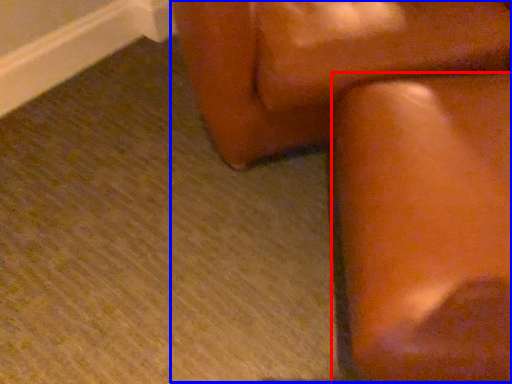
Question: Which of the following is the farthest to the observer, furniture (highlighted by a red box) or rocking chair (highlighted by a blue box)?

Choices:
 (A) furniture
 (B) rocking chair

Answer: (B)